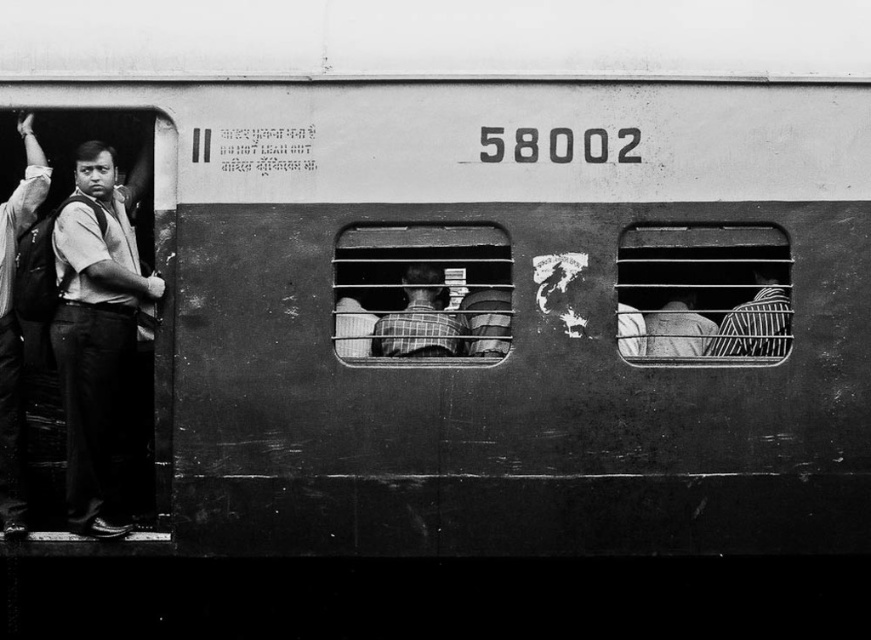
Question: Does plaid fabric shirt at center lie behind striped fabric shirt at right?

Choices:
 (A) yes
 (B) no

Answer: (A)

Question: Does metallic grid at right have a smaller size compared to striped fabric shirt at right?

Choices:
 (A) no
 (B) yes

Answer: (A)

Question: Does metallic grid train window at center appear on the left side of matte black backpack at left?

Choices:
 (A) no
 (B) yes

Answer: (A)

Question: Which point appears closest to the camera in this image?

Choices:
 (A) click(x=758, y=328)
 (B) click(x=28, y=168)
 (C) click(x=676, y=337)

Answer: (C)

Question: Which of the following is the farthest from the observer?

Choices:
 (A) (360, 288)
 (B) (392, 324)
 (C) (652, 342)

Answer: (B)

Question: Which point is closer to the camera taking this photo?

Choices:
 (A) (11, 403)
 (B) (498, 349)
 (C) (49, 336)

Answer: (B)